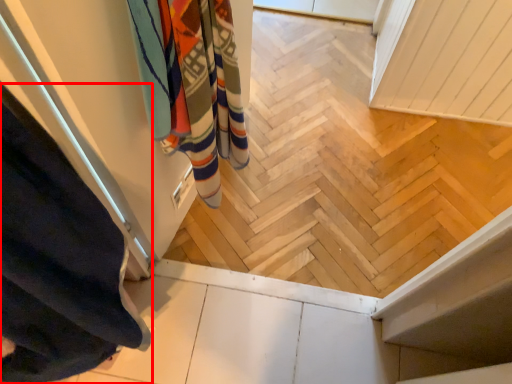
Question: From the image's perspective, where is curtain (annotated by the red box) located relative to bath towel?

Choices:
 (A) above
 (B) below

Answer: (B)